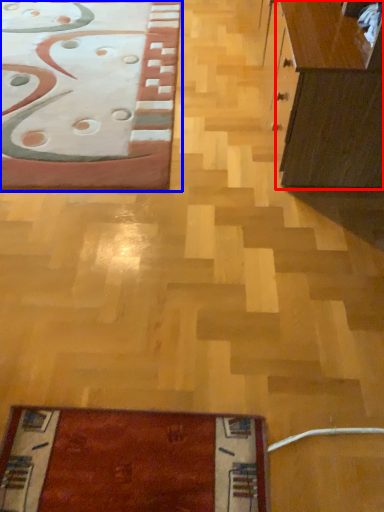
Question: Which object appears farthest to the camera in this image, cabinetry (highlighted by a red box) or furniture (highlighted by a blue box)?

Choices:
 (A) cabinetry
 (B) furniture

Answer: (B)